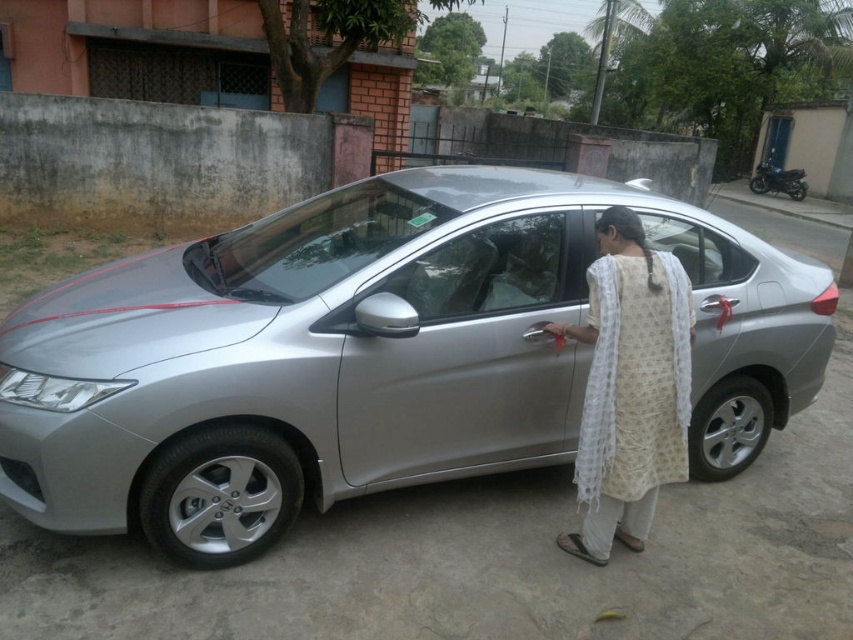
Question: Is satin silver car at center below white printed robe at center?

Choices:
 (A) no
 (B) yes

Answer: (A)

Question: Can you confirm if satin silver car at center is wider than white printed robe at center?

Choices:
 (A) yes
 (B) no

Answer: (A)

Question: Does satin silver car at center have a greater width compared to white printed robe at center?

Choices:
 (A) no
 (B) yes

Answer: (B)

Question: Which of the following is the closest to the observer?

Choices:
 (A) satin silver car at center
 (B) white printed robe at center

Answer: (A)